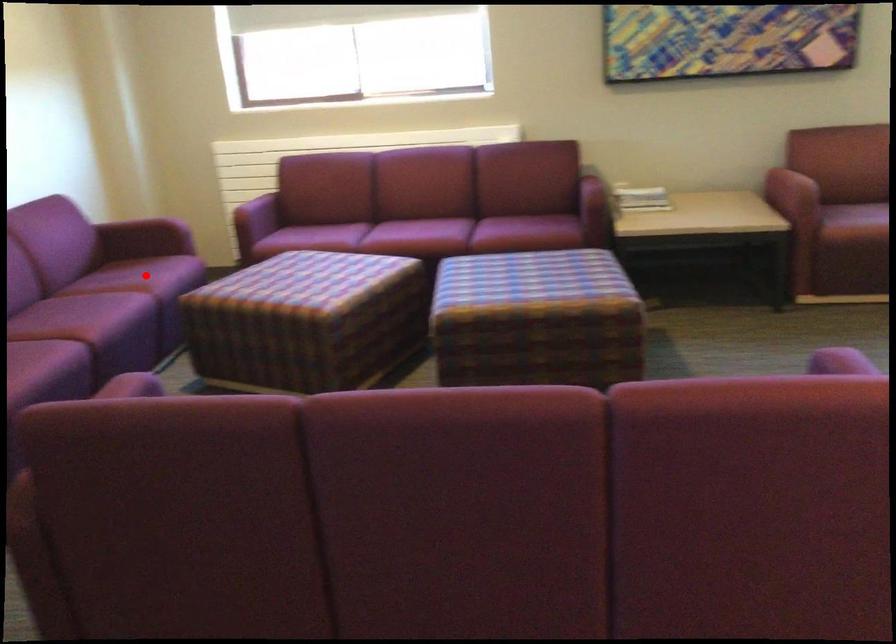
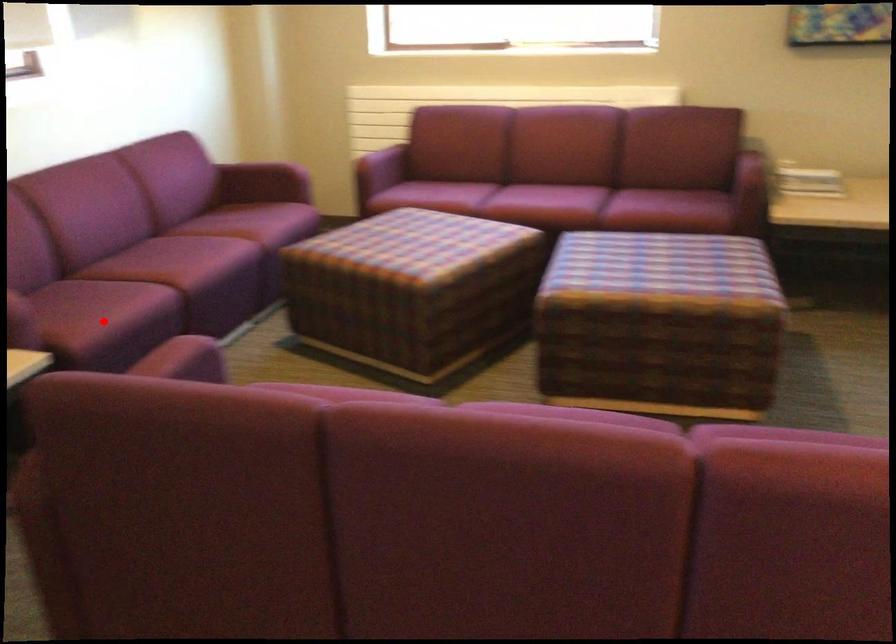
I am providing you with two images of the same scene from different viewpoints. A red point is marked on the first image and another point is marked on the second image. Is the red point in image1 aligned with the point shown in image2?

No